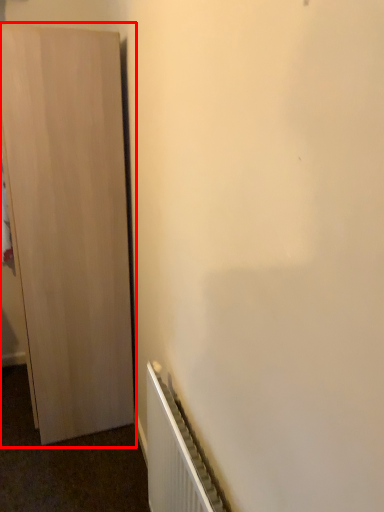
Question: In this image, where is cupboard (annotated by the red box) located relative to radiator?

Choices:
 (A) right
 (B) left

Answer: (B)